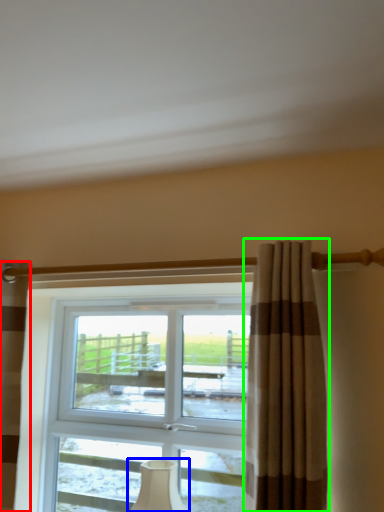
Question: Considering the real-world distances, which object is closest to curtain (highlighted by a red box)? table lamp (highlighted by a blue box) or curtain (highlighted by a green box).

Choices:
 (A) table lamp
 (B) curtain

Answer: (A)